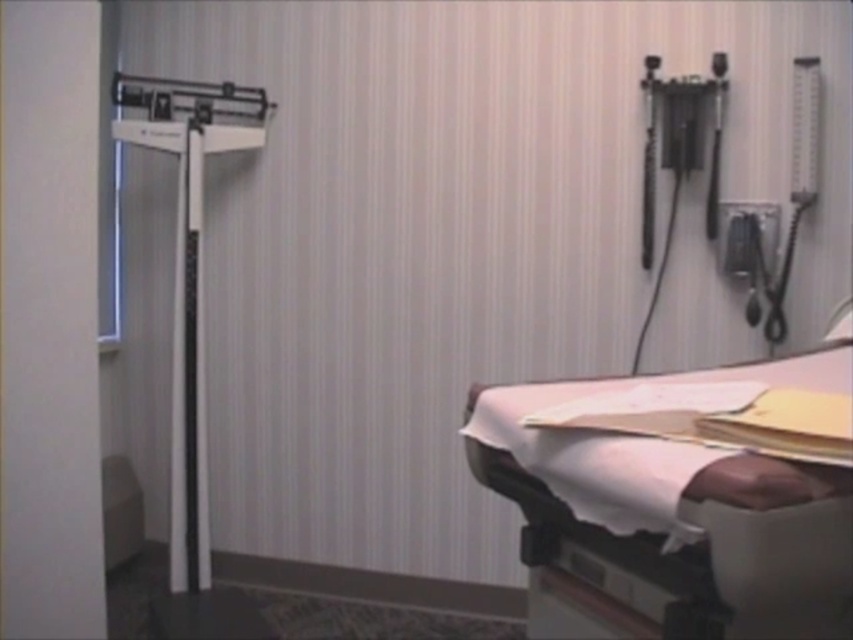
Question: From the image, what is the correct spatial relationship of white fabric hospital bed at lower right in relation to white plastic scale at left?

Choices:
 (A) above
 (B) below

Answer: (B)

Question: Which of the following is the farthest from the observer?

Choices:
 (A) (149, 83)
 (B) (782, 488)

Answer: (A)

Question: Which point appears farthest from the camera in this image?

Choices:
 (A) (177, 472)
 (B) (680, 492)

Answer: (A)

Question: Does white fabric hospital bed at lower right appear on the right side of white plastic scale at left?

Choices:
 (A) no
 (B) yes

Answer: (B)

Question: Is white fabric hospital bed at lower right closer to camera compared to white plastic scale at left?

Choices:
 (A) yes
 (B) no

Answer: (A)